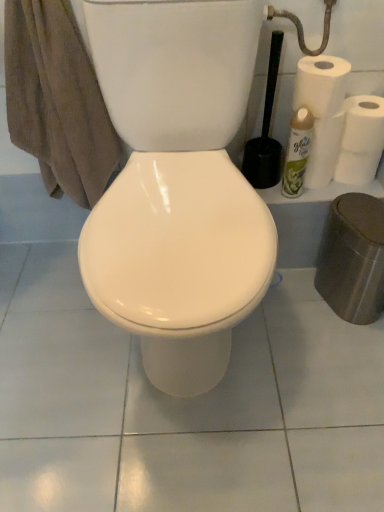
Question: Considering the relative positions of brown cotton towel at left and black plastic toilet brush at right in the image provided, is brown cotton towel at left to the left of black plastic toilet brush at right from the viewer's perspective?

Choices:
 (A) no
 (B) yes

Answer: (B)

Question: Can you confirm if brown cotton towel at left is smaller than black plastic toilet brush at right?

Choices:
 (A) yes
 (B) no

Answer: (B)

Question: From a real-world perspective, is brown cotton towel at left over black plastic toilet brush at right?

Choices:
 (A) yes
 (B) no

Answer: (B)

Question: Is brown cotton towel at left looking in the opposite direction of black plastic toilet brush at right?

Choices:
 (A) no
 (B) yes

Answer: (A)

Question: Is black plastic toilet brush at right a part of brown cotton towel at left?

Choices:
 (A) no
 (B) yes

Answer: (A)

Question: In terms of size, does white matte paper towel at upper right, arranged as the first paper towel when viewed from the right, appear bigger or smaller than brown cotton towel at left?

Choices:
 (A) big
 (B) small

Answer: (B)

Question: From the image's perspective, is white matte paper towel at upper right, which appears as the 2th paper towel when viewed from the top, above or below brown cotton towel at left?

Choices:
 (A) above
 (B) below

Answer: (B)

Question: Do you think white matte paper towel at upper right, marked as the 1th paper towel in a bottom-to-top arrangement, is within brown cotton towel at left, or outside of it?

Choices:
 (A) inside
 (B) outside

Answer: (B)

Question: Considering their positions, is white matte paper towel at upper right, marked as the second paper towel in a front-to-back arrangement, located in front of or behind brown cotton towel at left?

Choices:
 (A) behind
 (B) front

Answer: (A)

Question: Considering the relative positions of green matte air freshener at right and black plastic toilet brush at right in the image provided, is green matte air freshener at right to the left or to the right of black plastic toilet brush at right?

Choices:
 (A) right
 (B) left

Answer: (A)

Question: Considering the positions of green matte air freshener at right and black plastic toilet brush at right in the image, is green matte air freshener at right wider or thinner than black plastic toilet brush at right?

Choices:
 (A) thin
 (B) wide

Answer: (A)

Question: From the image's perspective, is green matte air freshener at right positioned above or below black plastic toilet brush at right?

Choices:
 (A) below
 (B) above

Answer: (A)

Question: Is green matte air freshener at right taller or shorter than black plastic toilet brush at right?

Choices:
 (A) tall
 (B) short

Answer: (B)

Question: Considering the positions of white matte toilet paper at right and white matte paper towel at upper right, marked as the second paper towel in a front-to-back arrangement, in the image, is white matte toilet paper at right taller or shorter than white matte paper towel at upper right, marked as the second paper towel in a front-to-back arrangement,?

Choices:
 (A) short
 (B) tall

Answer: (B)

Question: Is white matte toilet paper at right to the left or to the right of white matte paper towel at upper right, the second paper towel positioned from the left, in the image?

Choices:
 (A) left
 (B) right

Answer: (A)